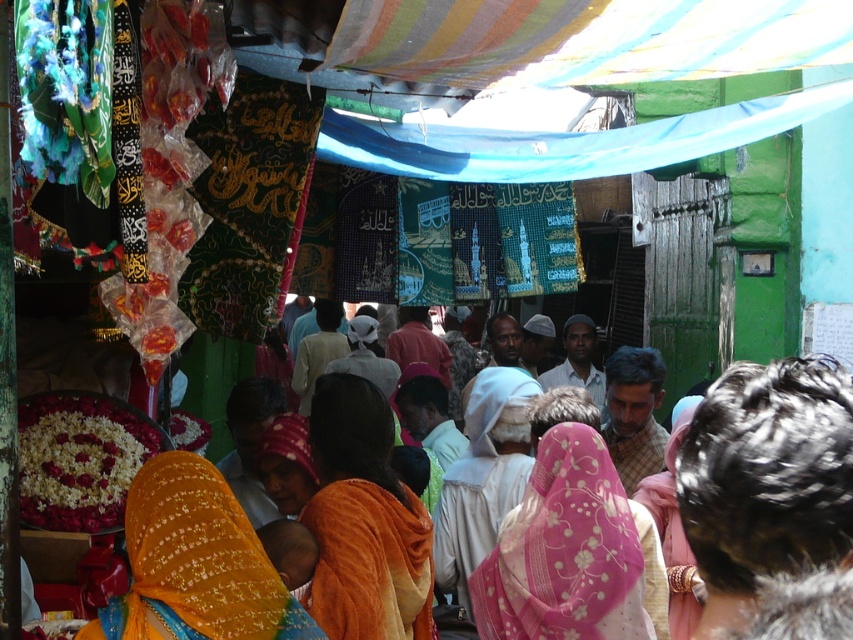
Question: Which of the following is the closest to the observer?

Choices:
 (A) (509, 508)
 (B) (616, 496)
 (C) (386, 579)

Answer: (C)

Question: Does pink embroidered scarf at center lie in front of orange fabric headscarf at center?

Choices:
 (A) yes
 (B) no

Answer: (A)

Question: Which point is closer to the camera?

Choices:
 (A) (369, 513)
 (B) (461, 522)
 (C) (280, 493)
 (D) (660, 557)

Answer: (A)

Question: Can you confirm if embroidered orange sari at center is bigger than orange fabric headscarf at center?

Choices:
 (A) yes
 (B) no

Answer: (B)

Question: Is orange fabric at center to the right of white fabric headscarf at center from the viewer's perspective?

Choices:
 (A) yes
 (B) no

Answer: (B)

Question: Which of the following is the closest to the observer?

Choices:
 (A) (318, 496)
 (B) (131, 490)
 (C) (625, 556)
 (D) (294, 426)

Answer: (B)